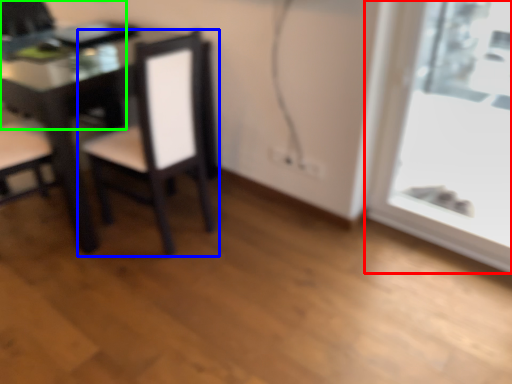
Question: Which is farther away from window (highlighted by a red box)? chair (highlighted by a blue box) or chair (highlighted by a green box)?

Choices:
 (A) chair
 (B) chair

Answer: (B)